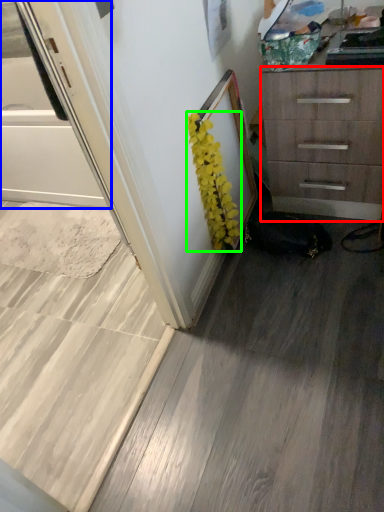
Question: Which is farther away from chest of drawers (highlighted by a red box)? screen door (highlighted by a blue box) or flower (highlighted by a green box)?

Choices:
 (A) screen door
 (B) flower

Answer: (A)